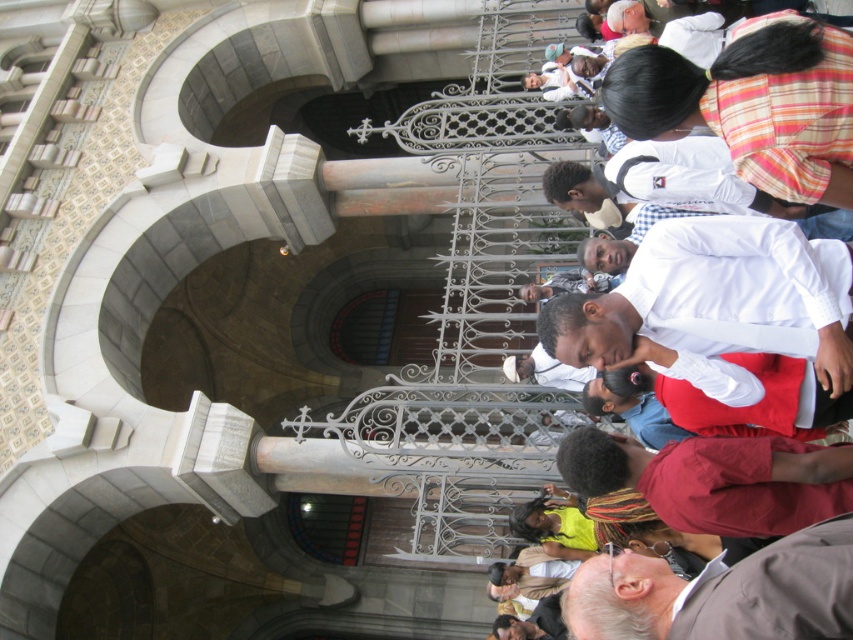
Question: Does white cotton shirt at center have a lesser width compared to gray fabric at lower right?

Choices:
 (A) yes
 (B) no

Answer: (B)

Question: Among these points, which one is farthest from the camera?

Choices:
 (A) (694, 600)
 (B) (827, 372)

Answer: (B)

Question: Does white cotton shirt at center appear over gray fabric at lower right?

Choices:
 (A) no
 (B) yes

Answer: (B)

Question: From the image, what is the correct spatial relationship of white cotton shirt at center in relation to gray fabric at lower right?

Choices:
 (A) right
 (B) left

Answer: (A)